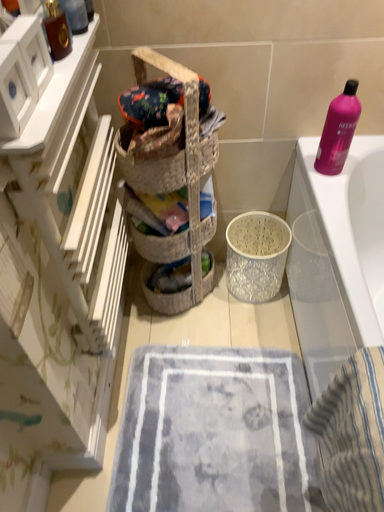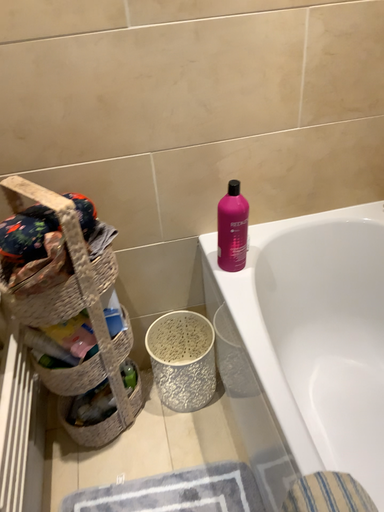
Question: Which way did the camera rotate in the video?

Choices:
 (A) rotated downward
 (B) rotated upward

Answer: (B)